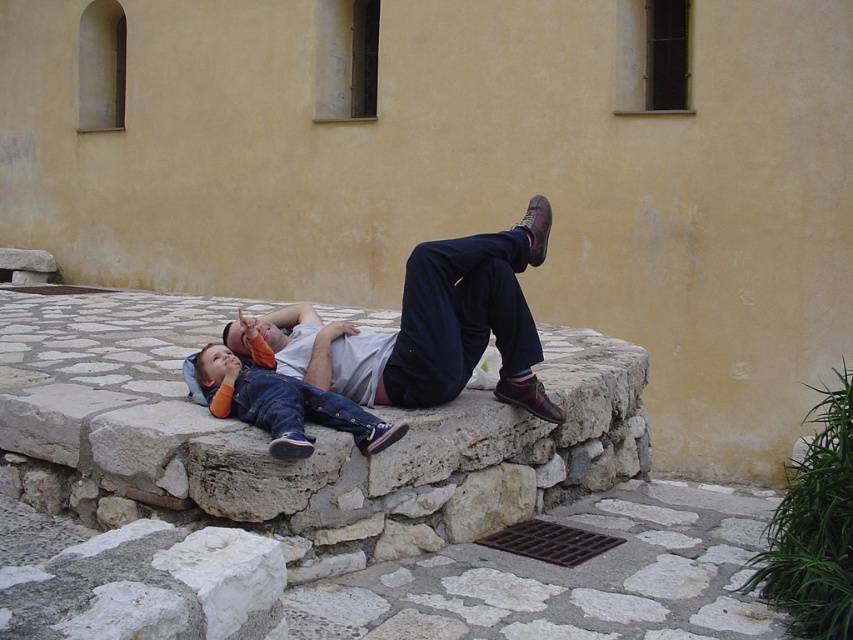
Which of these two, matte white shirt at center or denim pants at center, stands taller?

Result: matte white shirt at center

Can you confirm if matte white shirt at center is shorter than denim pants at center?

Incorrect, matte white shirt at center's height does not fall short of denim pants at center's.

Identify the location of matte white shirt at center. The height and width of the screenshot is (640, 853). [432, 326].